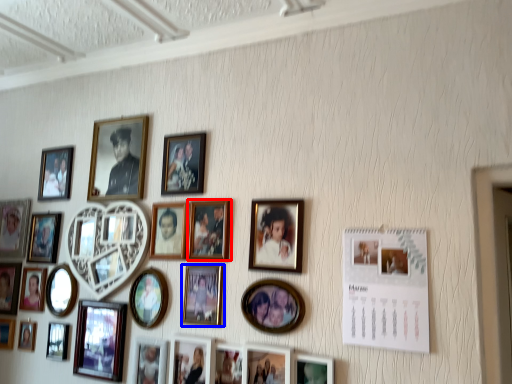
Question: Which point is closer to the camera, picture frame (highlighted by a red box) or picture frame (highlighted by a blue box)?

Choices:
 (A) picture frame
 (B) picture frame

Answer: (B)